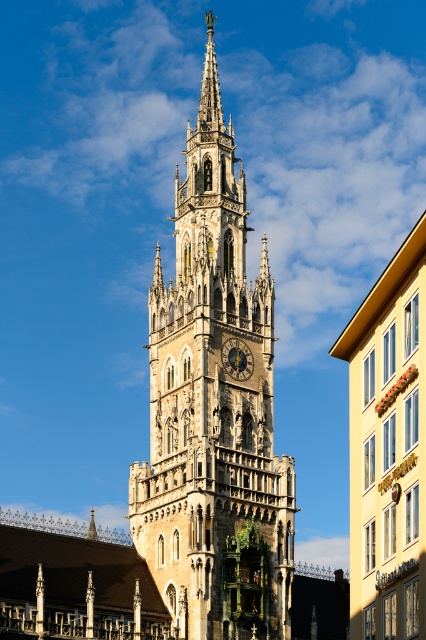
Question: Can you confirm if yellow matte building at right is positioned to the left of golden polished metal clock at center?

Choices:
 (A) yes
 (B) no

Answer: (B)

Question: Does golden stone clock tower at center come behind yellow matte building at right?

Choices:
 (A) no
 (B) yes

Answer: (B)

Question: Estimate the real-world distances between objects in this image. Which object is closer to the yellow matte building at right?

Choices:
 (A) golden polished metal clock at center
 (B) golden stone clock tower at center

Answer: (B)

Question: Does golden stone clock tower at center appear on the right side of yellow matte building at right?

Choices:
 (A) yes
 (B) no

Answer: (B)

Question: Which point is closer to the camera?

Choices:
 (A) (173, 304)
 (B) (244, 356)
 (C) (359, 596)

Answer: (C)

Question: Which point is farther from the camera taking this photo?

Choices:
 (A) (420, 456)
 (B) (244, 372)

Answer: (B)